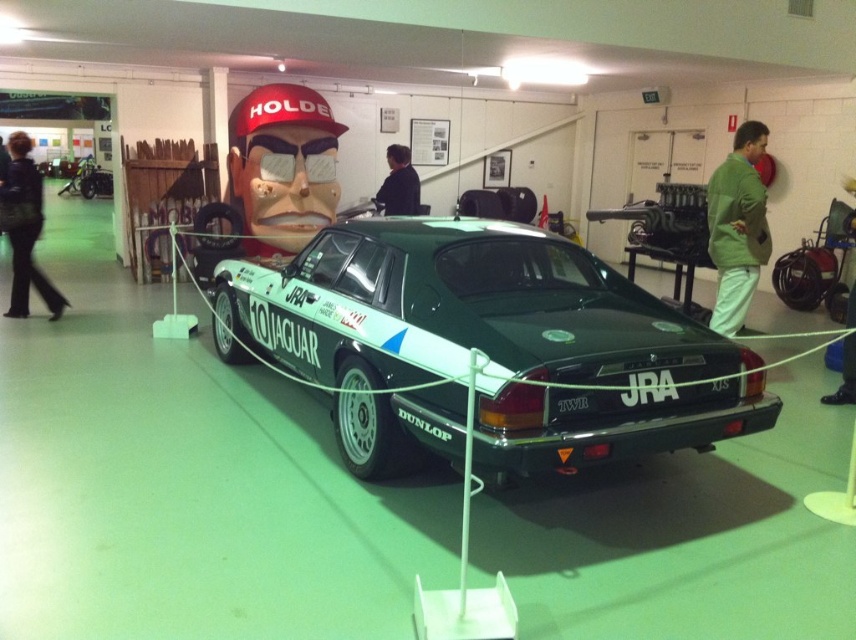
You are a security guard at the Jaguar XJS exhibition. You notice a black leather jacket at center and a green fabric pants at lower right placed near the rope barrier. Which item is closer to the entrance of the exhibition hall?

The black leather jacket at center is closer to the entrance because it is positioned to the left of the green fabric pants at lower right, implying it is nearer to the entrance direction.

You are a visitor at the Jaguar XJS exhibition and notice two jackets displayed near the car. The green cotton jacket at right and the black leather jacket at left. Which jacket is positioned closer to you?

The green cotton jacket at right is closer to the viewer than the black leather jacket at left.

You are a security guard at the exhibition and need to ensure the green cotton jacket at right does not block the view of the green matte car at center. Given their sizes, which object should you position closer to the entrance for better visibility of the car?

The green cotton jacket at right is smaller than the green matte car at center, so positioning the green cotton jacket at right closer to the entrance would allow the larger car to be seen more clearly behind it.